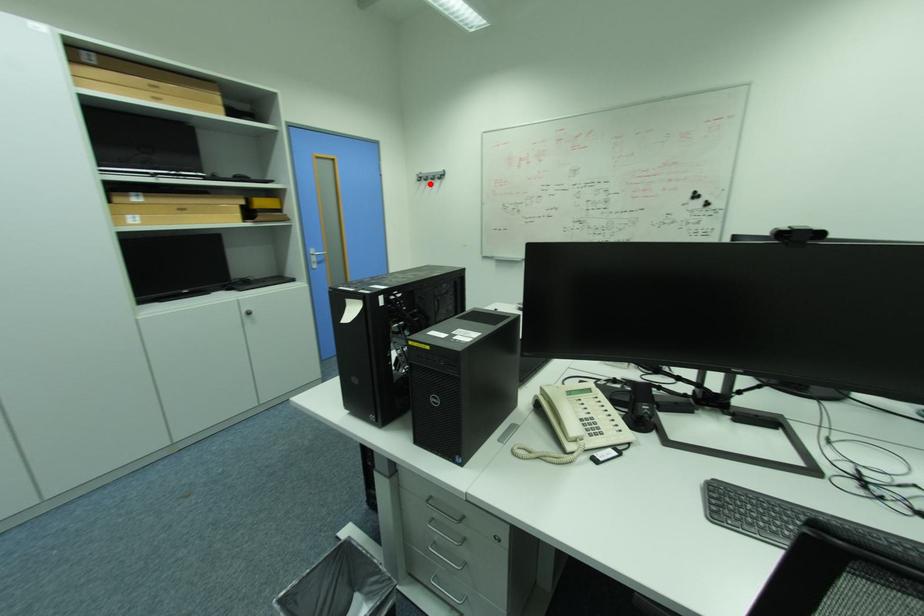
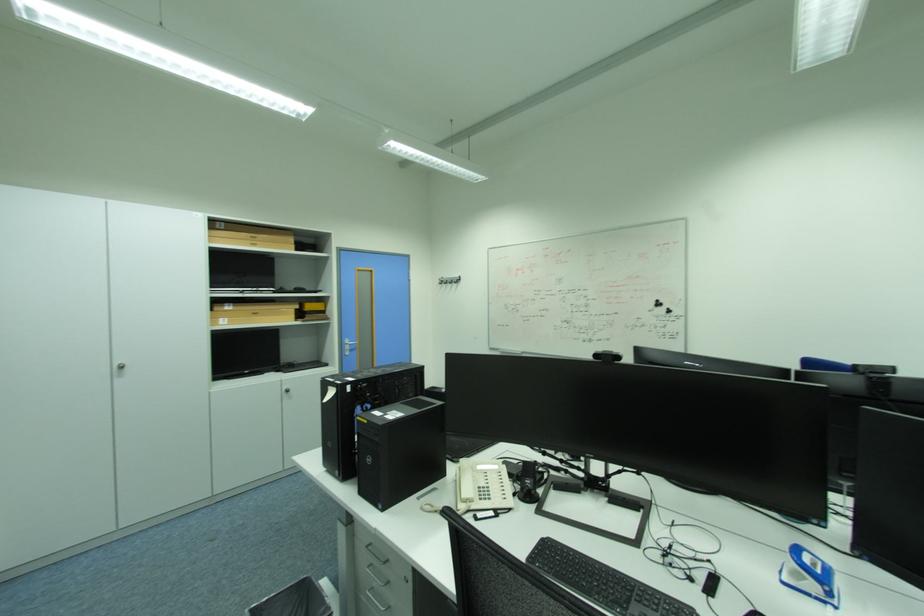
In the second image, find the point that corresponds to the highlighted location in the first image.

(451, 286)